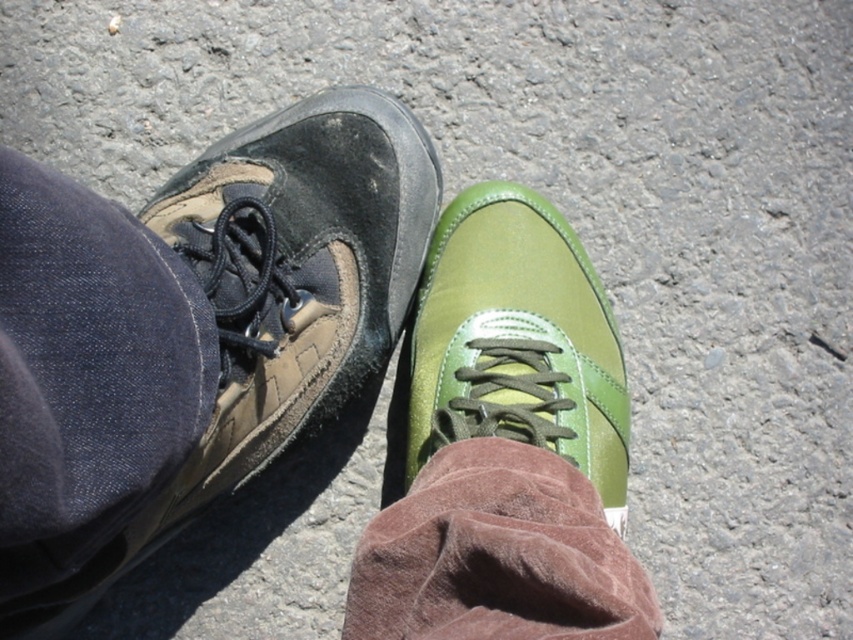
You are a shoemaker inspecting two shoes in the image. You need to determine which shoe is closer to you. The shoes are the green leather shoe at center and the brown suede sock at lower center. Which one is closer?

The green leather shoe at center is closer to you because the brown suede sock at lower center is positioned behind it.

You are a photographer trying to capture a close up of the matte brown leather shoe at left. The camera is currently focused on the point at coordinates point (271, 301). Is the camera focused on the correct object?

Yes, the camera is focused on the correct object because point (271, 301) corresponds to the matte brown leather shoe at left.